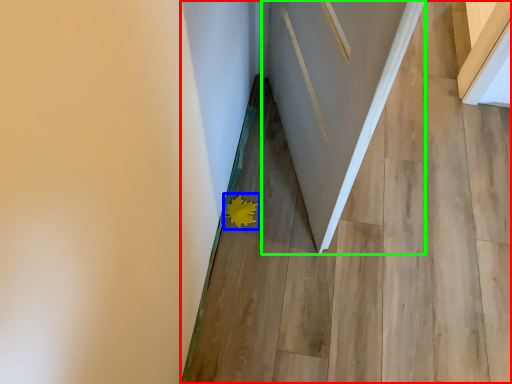
Question: Considering the real-world distances, which object is closest to stairwell (highlighted by a red box)? flower (highlighted by a blue box) or door (highlighted by a green box).

Choices:
 (A) flower
 (B) door

Answer: (B)